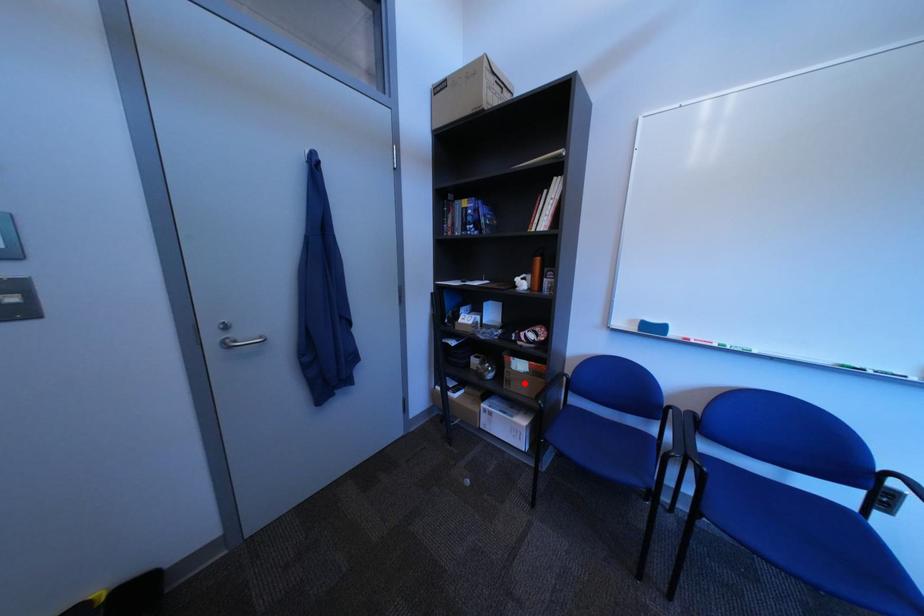
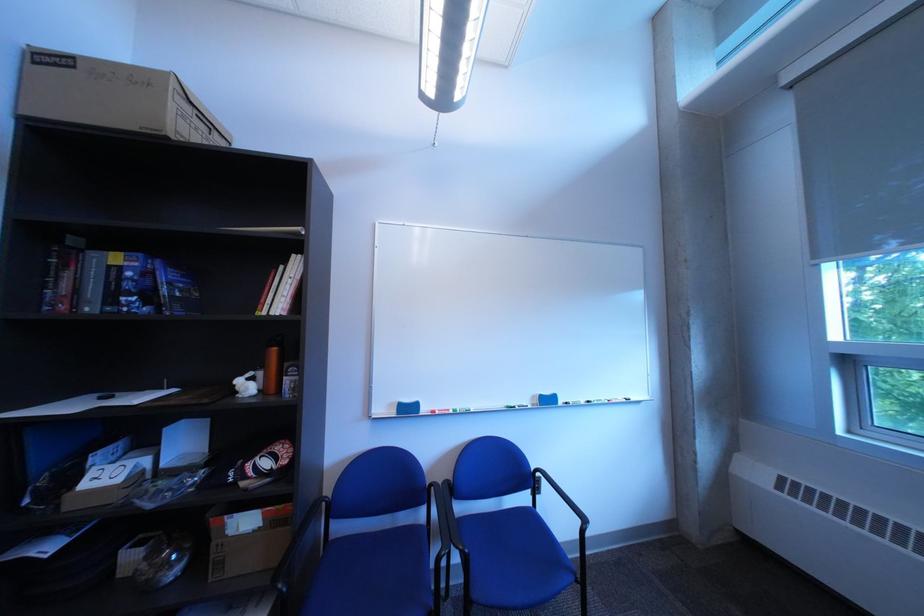
Question: A red point is marked in image1. In image2, is the corresponding 3D point closer to the camera or farther? Reply with the corresponding letter.

Choices:
 (A) The corresponding 3D point is closer.
 (B) The corresponding 3D point is farther.

Answer: (A)